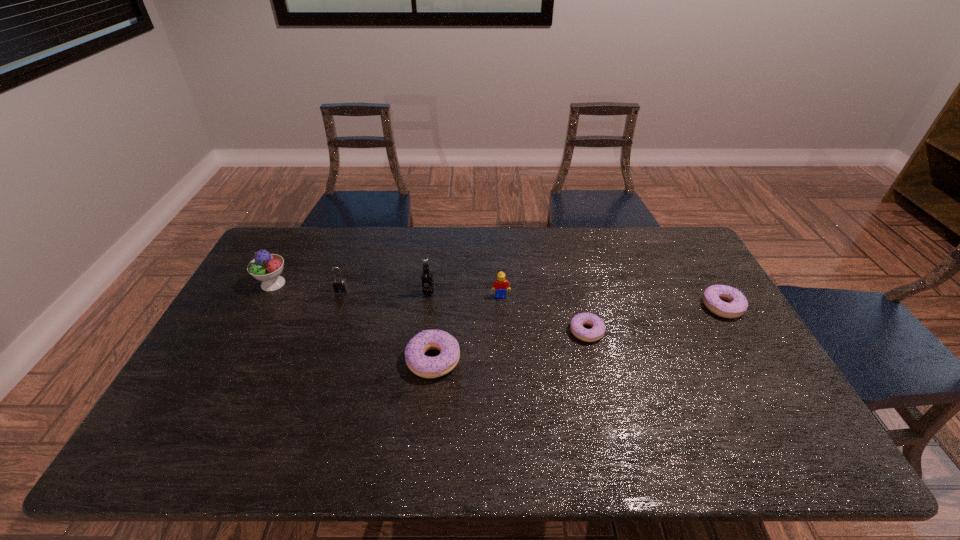
Image resolution: width=960 pixels, height=540 pixels. Find the location of `the tallest doughnut`. the tallest doughnut is located at coordinates (427, 367).

Find the location of a particular element. The width and height of the screenshot is (960, 540). the leftmost doughnut is located at coordinates (427, 367).

Identify the location of the second object from right to left. The height and width of the screenshot is (540, 960). (597, 331).

Where is `the shortest doughnut`? The width and height of the screenshot is (960, 540). the shortest doughnut is located at coordinates (597, 331).

The width and height of the screenshot is (960, 540). Find the location of `the rightmost object`. the rightmost object is located at coordinates (714, 294).

Where is `the second shortest object`? The image size is (960, 540). the second shortest object is located at coordinates (714, 294).

Identify the location of the third object from right to left. (500, 285).

The height and width of the screenshot is (540, 960). I want to click on icecream, so pyautogui.click(x=265, y=267).

I want to click on the sixth object from right to left, so click(x=340, y=285).

You are a GUI agent. You are given a task and a screenshot of the screen. Output one action in this format:
    pyautogui.click(x=<x>, y=<y>)
    Task: Click on the root beer
    The width and height of the screenshot is (960, 540).
    Given the screenshot: What is the action you would take?
    pyautogui.click(x=426, y=277)